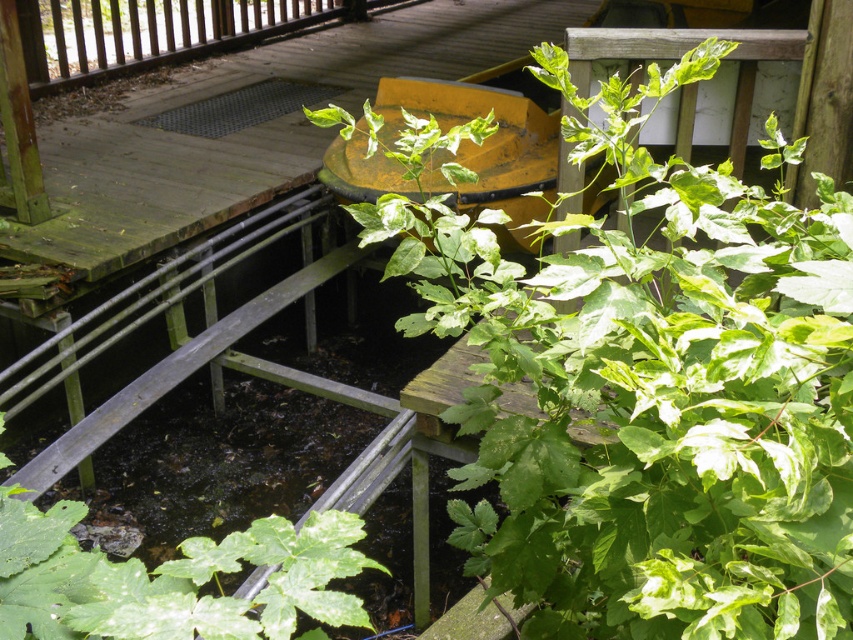
Question: Can you confirm if green leafy plant at center is bigger than green matte leafy plant at lower left?

Choices:
 (A) yes
 (B) no

Answer: (A)

Question: Which of the following is the closest to the observer?

Choices:
 (A) (706, 426)
 (B) (311, 600)

Answer: (A)

Question: Is green leafy plant at center below green matte leafy plant at lower left?

Choices:
 (A) no
 (B) yes

Answer: (A)

Question: Which point is closer to the camera taking this photo?

Choices:
 (A) (525, 454)
 (B) (190, 564)

Answer: (B)

Question: Can you confirm if green leafy plant at center is positioned to the left of green matte leafy plant at lower left?

Choices:
 (A) yes
 (B) no

Answer: (B)